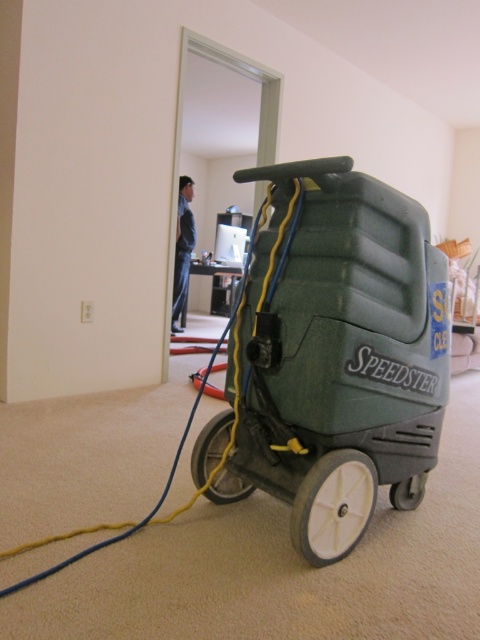
Question: Which point is farther to the camera?

Choices:
 (A) (347, 529)
 (B) (406, 230)
 (C) (420, 486)
 (D) (180, 225)

Answer: (D)

Question: Is green plastic carpet cleaner at center below white rubber wheel at center?

Choices:
 (A) no
 (B) yes

Answer: (A)

Question: Which of the following is the farthest from the observer?

Choices:
 (A) black rubber wheel at lower center
 (B) white rubber wheel at lower center

Answer: (B)

Question: Among these objects, which one is farthest from the camera?

Choices:
 (A) blue jeans at center
 (B) white rubber wheel at lower center
 (C) white rubber wheel at center
 (D) green plastic carpet cleaner at center

Answer: (A)

Question: Considering the relative positions of blue jeans at center and white rubber wheel at lower center in the image provided, where is blue jeans at center located with respect to white rubber wheel at lower center?

Choices:
 (A) left
 (B) right

Answer: (A)

Question: Is white rubber wheel at center to the left of black rubber wheel at lower center from the viewer's perspective?

Choices:
 (A) yes
 (B) no

Answer: (B)